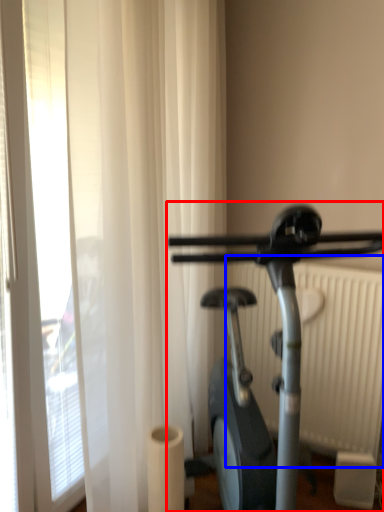
Question: Among these objects, which one is farthest to the camera, stationary bicycle (highlighted by a red box) or radiator (highlighted by a blue box)?

Choices:
 (A) stationary bicycle
 (B) radiator

Answer: (B)